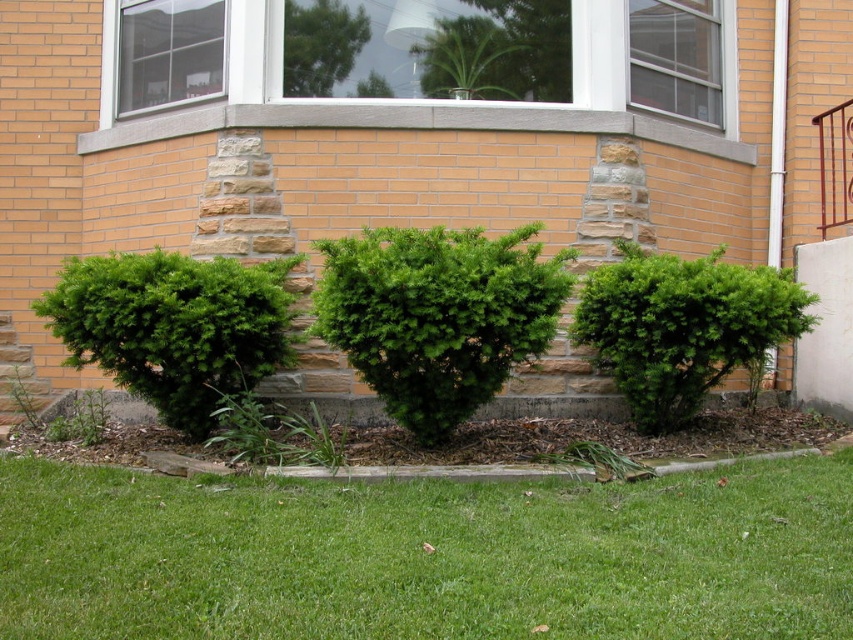
Question: Which point appears farthest from the camera in this image?

Choices:
 (A) 634,244
 (B) 679,570

Answer: (A)

Question: Among these objects, which one is nearest to the camera?

Choices:
 (A) green textured bush at left
 (B) green leafy bush at center
 (C) green textured shrub at center
 (D) green grass at lower center

Answer: (D)

Question: Can you confirm if green grass at lower center is smaller than green textured bush at left?

Choices:
 (A) yes
 (B) no

Answer: (B)

Question: Which of these objects is positioned farthest from the green textured bush at left?

Choices:
 (A) green grass at lower center
 (B) green leafy bush at center
 (C) green textured shrub at center

Answer: (B)

Question: Does green grass at lower center appear on the right side of green leafy bush at center?

Choices:
 (A) yes
 (B) no

Answer: (B)

Question: Is the position of green textured shrub at center more distant than that of green leafy bush at center?

Choices:
 (A) yes
 (B) no

Answer: (B)